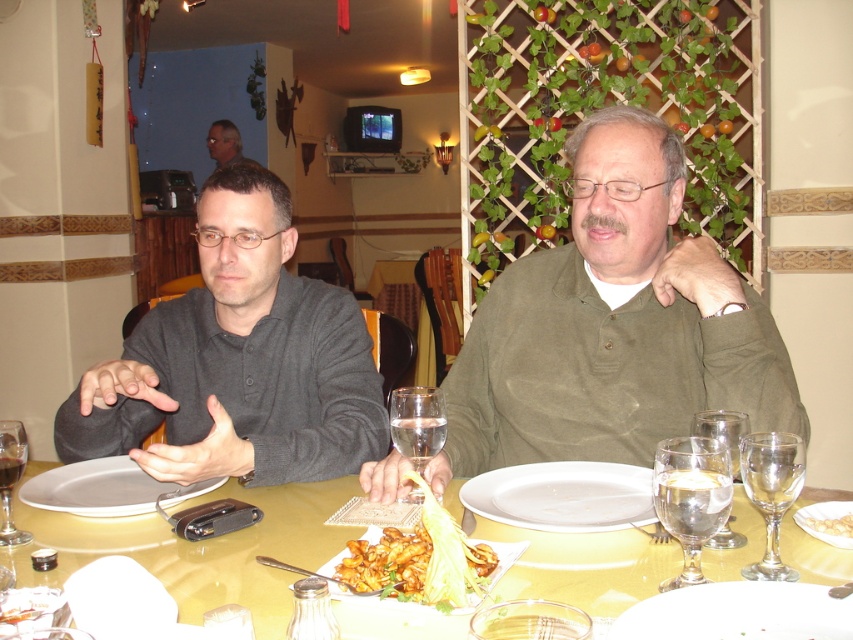
Question: Estimate the real-world distances between objects in this image. Which object is farther from the clear glass water at table center?

Choices:
 (A) golden crispy shrimp at center
 (B) clear glass wine glass at center

Answer: (B)

Question: Among these points, which one is nearest to the camera?

Choices:
 (A) (227, 536)
 (B) (695, 461)

Answer: (B)

Question: Is yellow matte table at center above transparent glass wine glass at table center?

Choices:
 (A) no
 (B) yes

Answer: (A)

Question: Is yellow matte table at center above transparent glass at table center?

Choices:
 (A) yes
 (B) no

Answer: (B)

Question: Is golden crispy shrimp at center closer to the viewer compared to clear glass water at table center?

Choices:
 (A) yes
 (B) no

Answer: (A)

Question: Which object appears farthest from the camera in this image?

Choices:
 (A) clear glass wine glass at lower right
 (B) clear glass water at table center

Answer: (B)